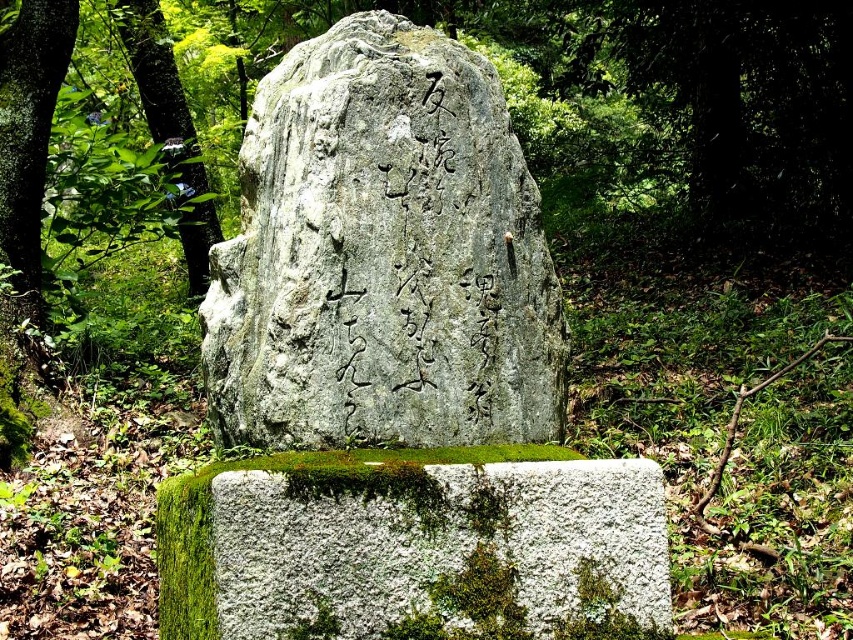
You are an archaeologist examining the monument. You need to place a protective covering over the gray stone boulder at center and the green mossy stone at center. Which one requires a larger covering based on their widths?

The green mossy stone at center requires a larger covering because its width is greater than the gray stone boulder at center.

You are a hiker who wants to take a photo of the green mossy stone at center and the green leafy tree at left. From your current position, which object should you aim your camera at first to capture both in the frame?

The green mossy stone at center is located below the green leafy tree at left, so you should aim your camera at the green leafy tree at left first to ensure both objects are in the frame.

Looking at this image, you are a hiker in the forest and want to take a photo of the gray stone boulder at center and the green leafy tree at left. Which object should you stand closer to if you want both to be in the frame without moving your camera position?

You should stand closer to the green leafy tree at left because the gray stone boulder at center is positioned on the right side of it, so moving closer to the tree will keep both in frame.